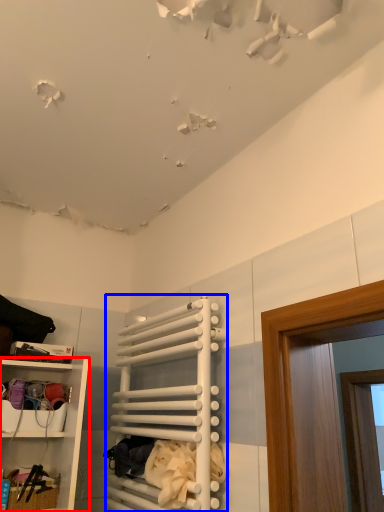
Question: Among these objects, which one is farthest to the camera, shelf (highlighted by a red box) or cabinet (highlighted by a blue box)?

Choices:
 (A) shelf
 (B) cabinet

Answer: (A)